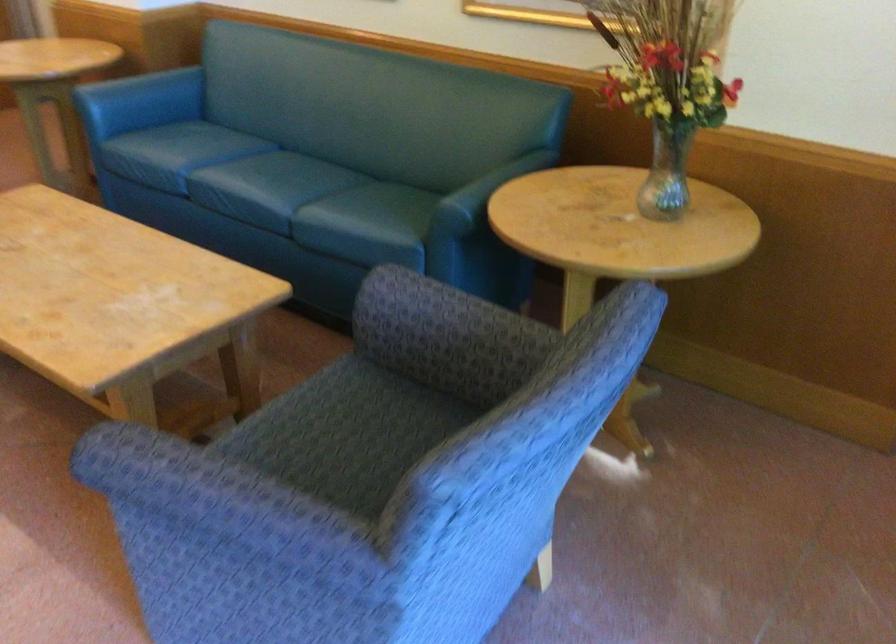
At what (x,y) coordinates should I click in order to perform the action: click on blue sofa armrest. Please return your answer as a coordinate pair (x, y). The image size is (896, 644). Looking at the image, I should click on tap(140, 102).